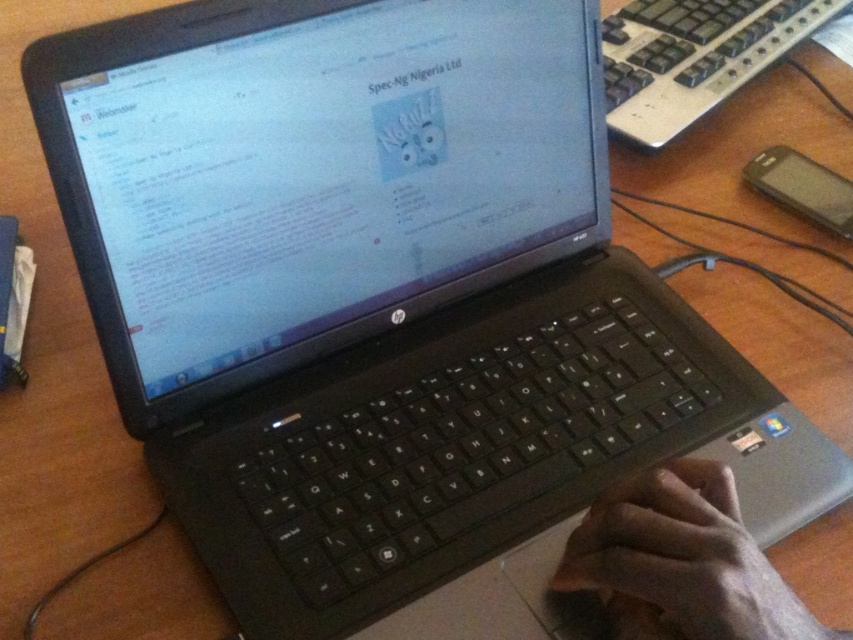
Who is taller, skinny white hand at lower right or black plastic keyboard at upper right?

Standing taller between the two is black plastic keyboard at upper right.

Is skinny white hand at lower right to the right of black plastic keyboard at upper right from the viewer's perspective?

In fact, skinny white hand at lower right is to the left of black plastic keyboard at upper right.

Is point (711, 525) less distant than point (637, 72)?

Yes, point (711, 525) is closer to viewer.

This screenshot has width=853, height=640. I want to click on skinny white hand at lower right, so click(682, 561).